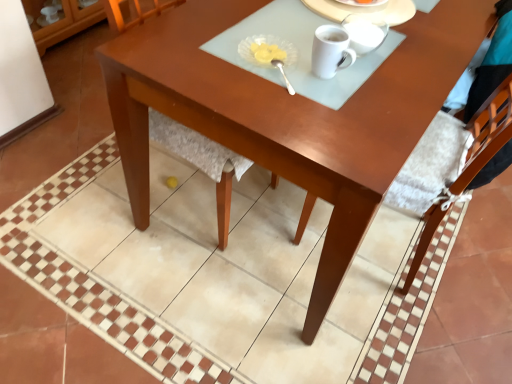
I want to click on unoccupied area behind white glossy mug at upper center, arranged as the second tableware when viewed from the top, so click(354, 11).